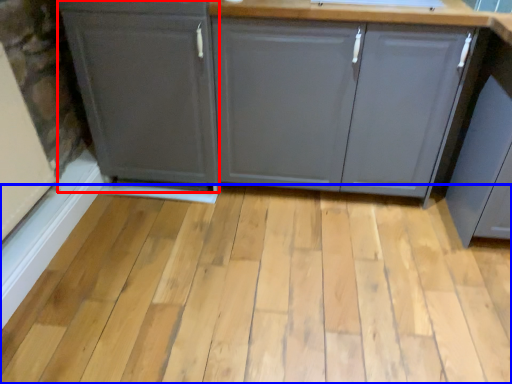
Question: Which of the following is the farthest to the observer, cabinetry (highlighted by a red box) or plank (highlighted by a blue box)?

Choices:
 (A) cabinetry
 (B) plank

Answer: (A)